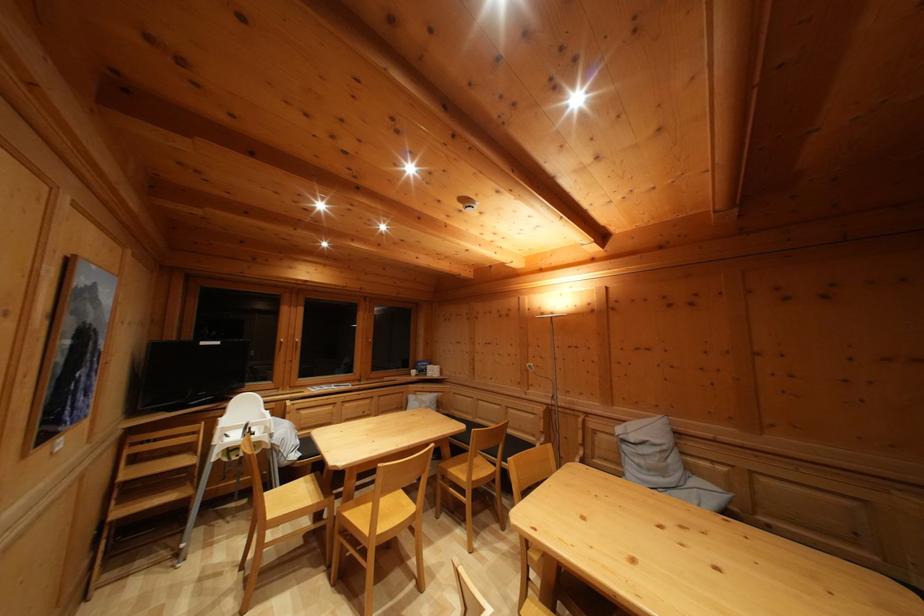
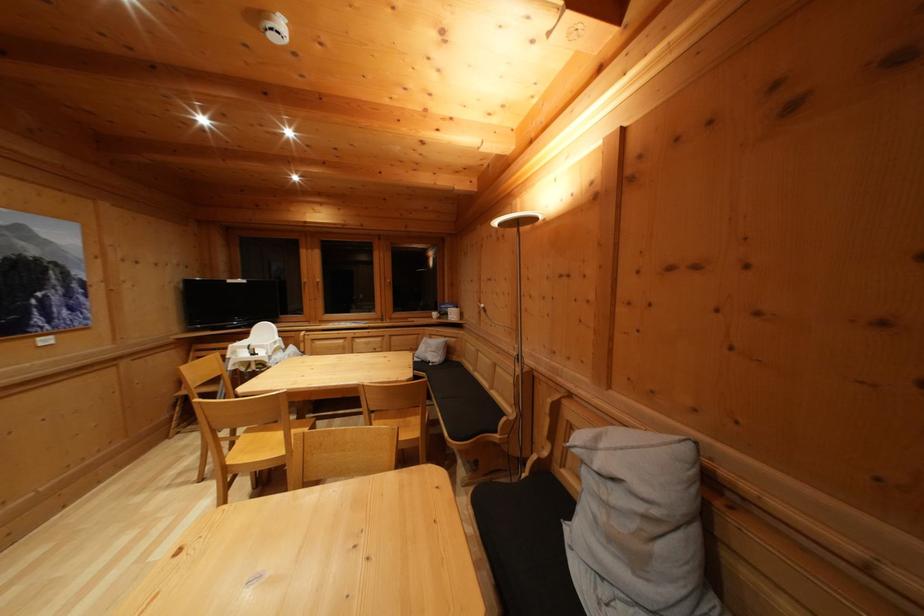
The point at (252, 432) is marked in the first image. Where is the corresponding point in the second image?

(254, 353)